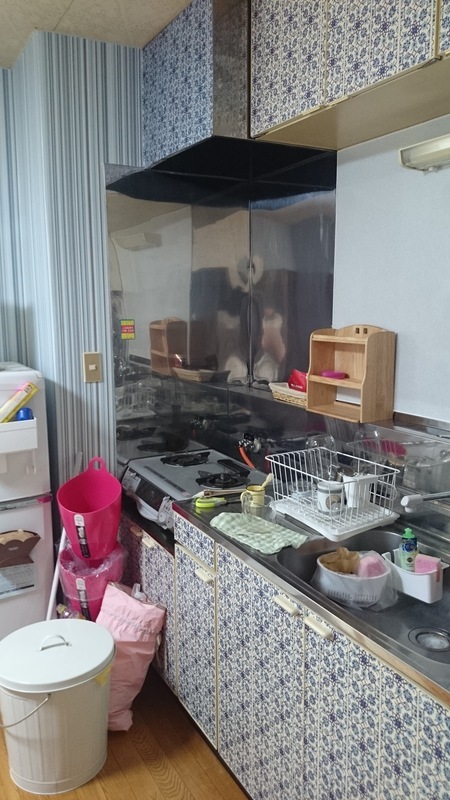
You are a GUI agent. You are given a task and a screenshot of the screen. Output one action in this format:
    pyautogui.click(x=<x>, y=<y>)
    Task: Click on the wooden shelf
    The height and width of the screenshot is (800, 450).
    Given the screenshot: What is the action you would take?
    pyautogui.click(x=336, y=336), pyautogui.click(x=334, y=382)